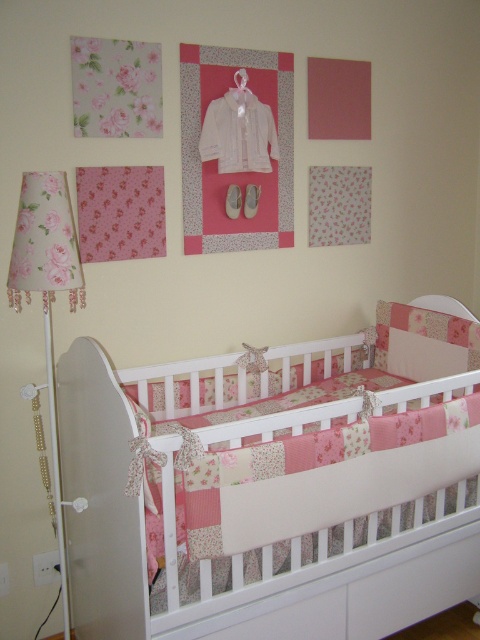
You are a parent setting up a nursery and want to place a small nightlight near the white patchwork crib at lower left and the floral fabric lampshade at left. Which object should you place the nightlight closer to if you want it to be proportionally smaller in size?

The nightlight should be placed closer to the floral fabric lampshade at left because the white patchwork crib at lower left is larger in size, so placing the nightlight near the smaller object would make it appear proportionally smaller.

You are a parent trying to place a new mobile above the white patchwork crib at lower left. The mobile requires a minimum of 60 centimeters of space between the crib and any nearby objects like the floral fabric lampshade at left. Is the current distance sufficient?

The distance between the white patchwork crib at lower left and the floral fabric lampshade at left is 64.25 centimeters, which exceeds the required 60 centimeters. Therefore, the current distance is sufficient for placing the mobile.

You are a parent setting up a nursery and want to place a new mobile above the white patchwork crib at lower left. You also see the floral fabric lampshade at left. Which object should you position the mobile closer to?

The mobile should be positioned closer to the white patchwork crib at lower left since it is located to the right of the floral fabric lampshade at left.